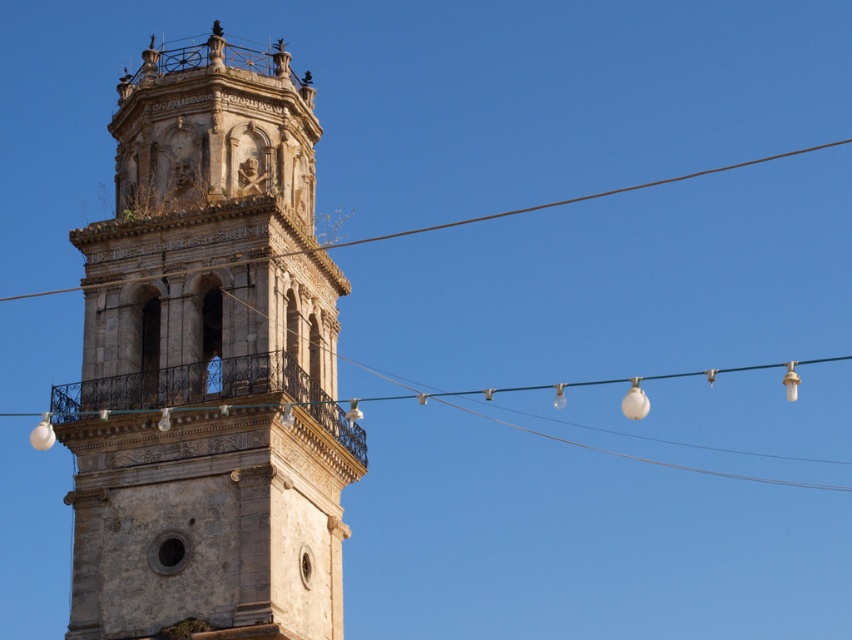
Can you confirm if stone tower at left is wider than green wire at center?

In fact, stone tower at left might be narrower than green wire at center.

Can you confirm if stone tower at left is positioned below green wire at center?

Incorrect, stone tower at left is not positioned below green wire at center.

The width and height of the screenshot is (852, 640). I want to click on stone tower at left, so click(x=208, y=365).

Is brown wire at upper center taller than green wire at center?

Yes.

Which is more to the left, brown wire at upper center or green wire at center?

green wire at center is more to the left.

Describe the element at coordinates (562, 200) in the screenshot. The width and height of the screenshot is (852, 640). I see `brown wire at upper center` at that location.

The height and width of the screenshot is (640, 852). I want to click on brown wire at upper center, so click(562, 200).

Which is in front, point (101, 234) or point (361, 241)?

Point (101, 234) is in front.

Does stone tower at left appear on the left side of brown wire at upper center?

Indeed, stone tower at left is positioned on the left side of brown wire at upper center.

Between point (337, 512) and point (223, 266), which one is positioned behind?

Point (337, 512)

Locate an element on the screen. stone tower at left is located at coordinates (208, 365).